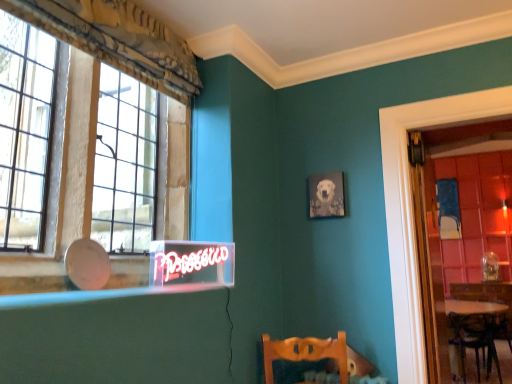
Question: From the image's perspective, is wooden round table at lower right located above or below matte gray canvas at upper center?

Choices:
 (A) above
 (B) below

Answer: (B)

Question: Considering their positions, is wooden round table at lower right located in front of or behind matte gray canvas at upper center?

Choices:
 (A) behind
 (B) front

Answer: (A)

Question: Considering the real-world distances, which object is farthest from the glass paneled window at left?

Choices:
 (A) clear glass door at right
 (B) matte glass window sill at lower left
 (C) wooden round table at lower right
 (D) matte gray canvas at upper center

Answer: (C)

Question: Which object is positioned farthest from the matte gray canvas at upper center?

Choices:
 (A) glass paneled window at left
 (B) wooden round table at lower right
 (C) clear glass door at right
 (D) matte glass window sill at lower left

Answer: (D)